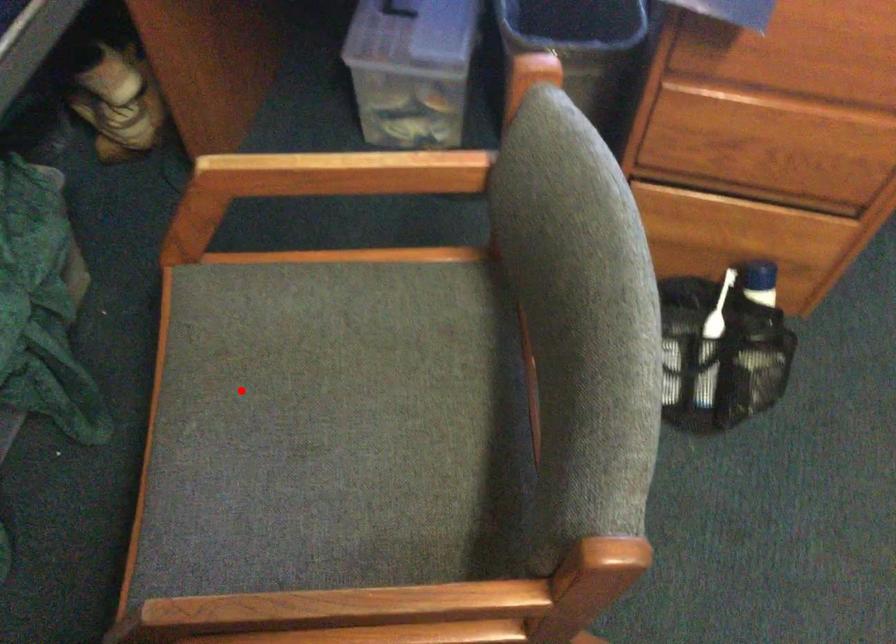
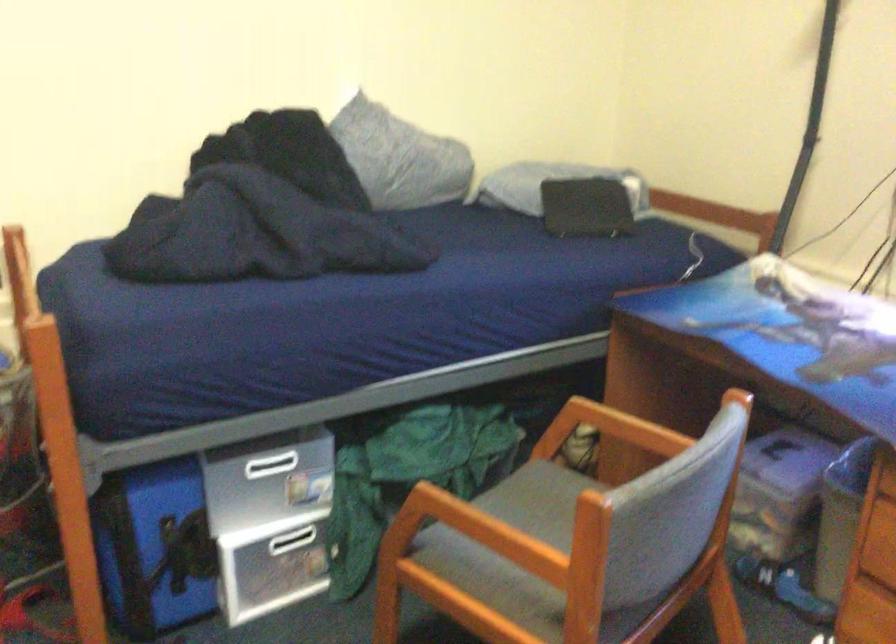
Locate, in the second image, the point that corresponds to the highlighted location in the first image.

(519, 518)